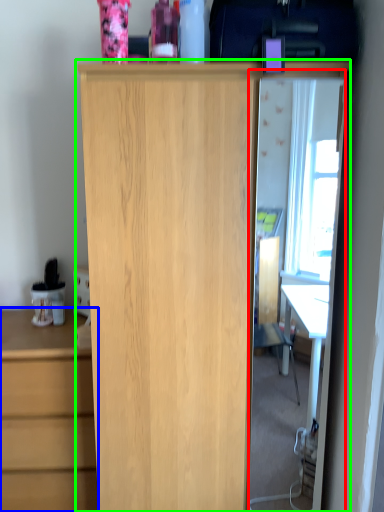
Question: Estimate the real-world distances between objects in this image. Which object is closer to glass door (highlighted by a red box), chest of drawers (highlighted by a blue box) or cupboard (highlighted by a green box)?

Choices:
 (A) chest of drawers
 (B) cupboard

Answer: (A)